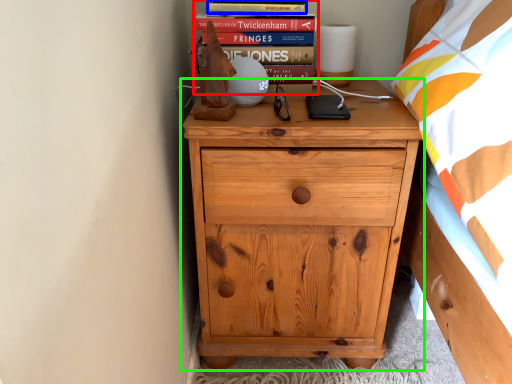
Question: Which object is positioned farthest from book (highlighted by a red box)? Select from paperback book (highlighted by a blue box) and chest of drawers (highlighted by a green box).

Choices:
 (A) paperback book
 (B) chest of drawers

Answer: (B)